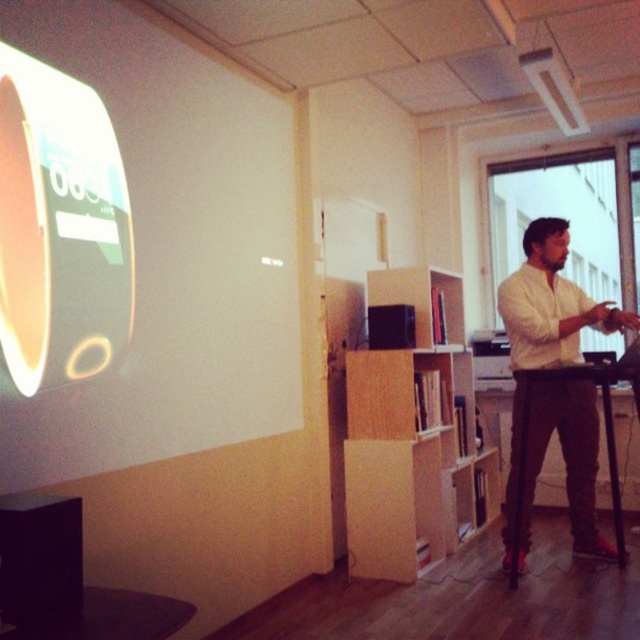
You are sitting in the audience facing the front of the room. You notice both the white matte projection screen at upper left and the white cotton shirt at right. Which object is positioned more to your left side?

The white matte projection screen at upper left is positioned to the left of the white cotton shirt at right, so it is more to your left side.

You are organizing a small event in this room and need to place a 1.2 meter wide banner between the wooden bookshelf at center and the white cotton shirt at right. Will the space between them be sufficient?

The wooden bookshelf at center is wider than the white cotton shirt at right. However, the exact distance between them isn not specified in the provided description. Therefore, it is uncertain whether the 1.2 meter wide banner will fit without more information about their separation.